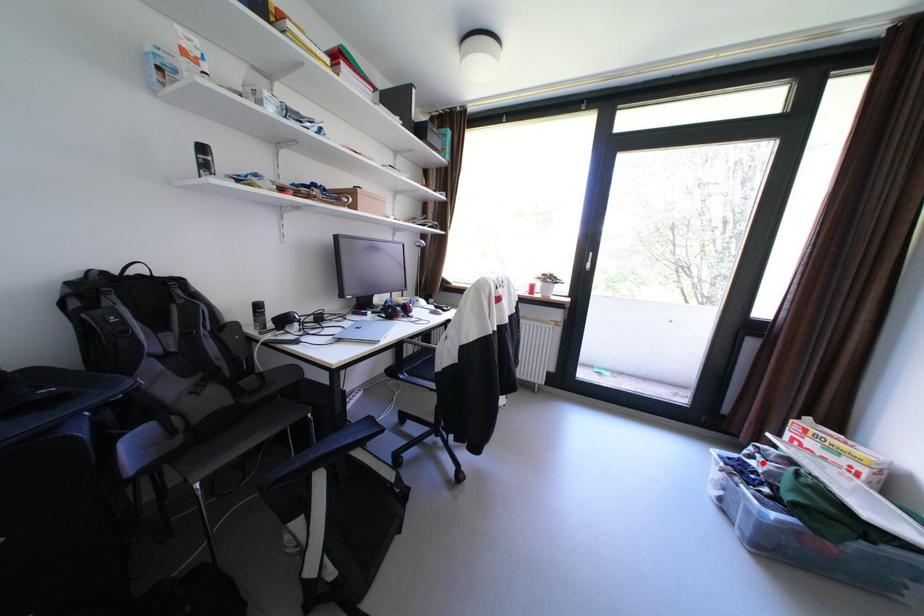
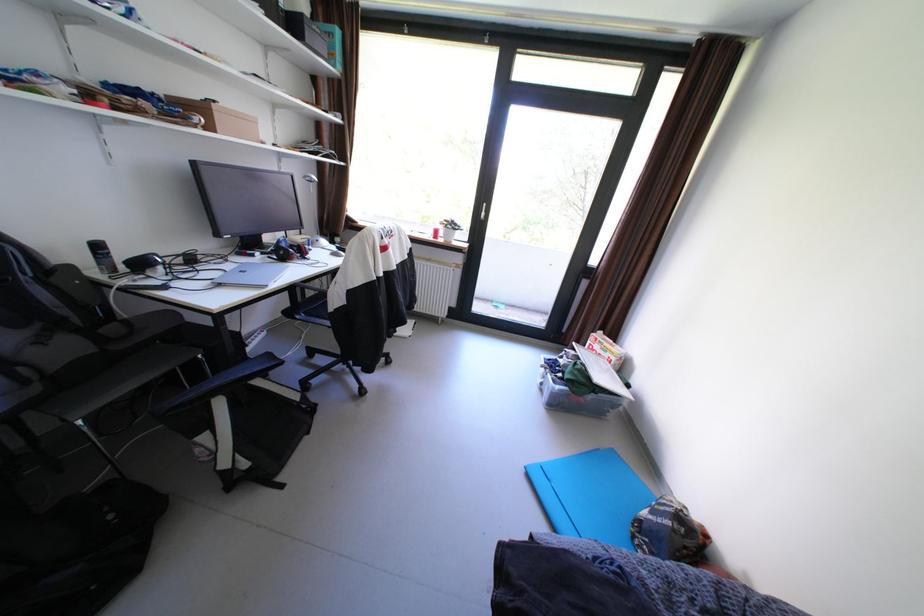
Question: I am providing you with two images of the same scene from different viewpoints. A red point is shown in image1. For the corresponding object point in image2, is it positioned nearer or farther from the camera?

Choices:
 (A) Nearer
 (B) Farther

Answer: (A)